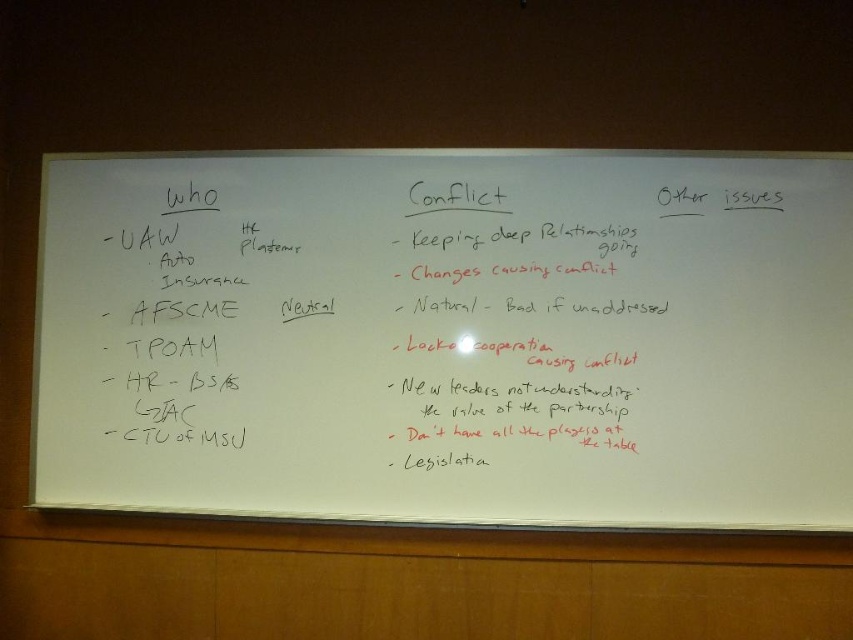
Based on the scene description, can you determine the spatial relationship between the whiteboard at center and the black marker text at center?

The whiteboard at center is below the black marker text at center.